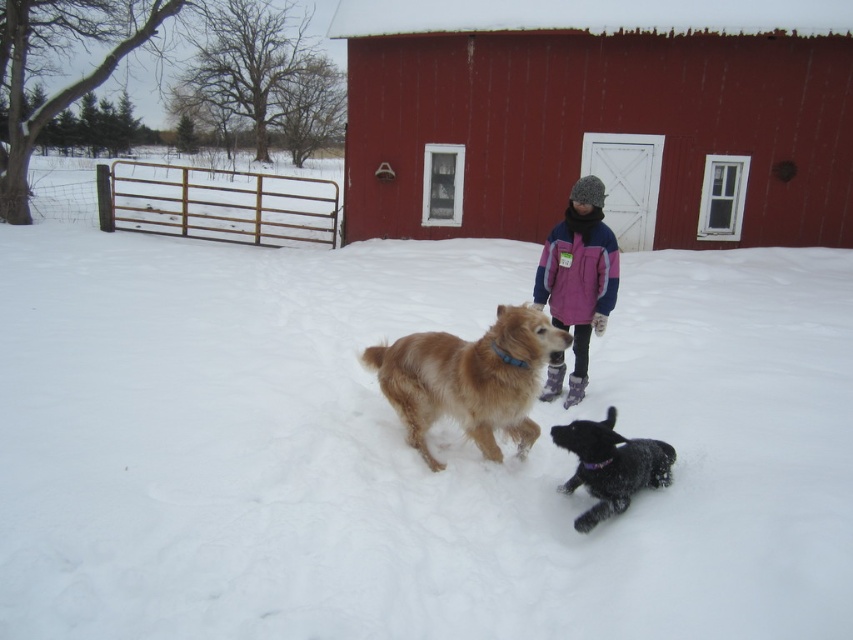
Which of these two, smooth wooden barn at center or golden fur dog at center, stands shorter?

With less height is golden fur dog at center.

Is smooth wooden barn at center to the left of golden fur dog at center from the viewer's perspective?

Incorrect, smooth wooden barn at center is not on the left side of golden fur dog at center.

The image size is (853, 640). Describe the element at coordinates (601, 118) in the screenshot. I see `smooth wooden barn at center` at that location.

Image resolution: width=853 pixels, height=640 pixels. What are the coordinates of `smooth wooden barn at center` in the screenshot? It's located at (601, 118).

Is purple fleece jacket at center below shiny black dog at lower right?

No.

Which is behind, point (599, 228) or point (670, 451)?

The point (599, 228) is more distant.

This screenshot has width=853, height=640. What are the coordinates of `purple fleece jacket at center` in the screenshot? It's located at (579, 275).

Between smooth wooden barn at center and shiny black dog at lower right, which one is positioned higher?

Positioned higher is smooth wooden barn at center.

Can you confirm if smooth wooden barn at center is shorter than shiny black dog at lower right?

No, smooth wooden barn at center is not shorter than shiny black dog at lower right.

Where is `smooth wooden barn at center`? smooth wooden barn at center is located at coordinates (601, 118).